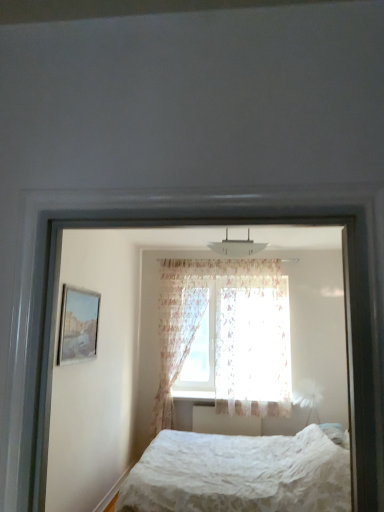
Question: Considering the relative sizes of white textured bed at center, which is the 1th bed from top to bottom, and white lace bed at lower center, the second bed from the front, in the image provided, is white textured bed at center, which is the 1th bed from top to bottom, wider than white lace bed at lower center, the second bed from the front,?

Choices:
 (A) yes
 (B) no

Answer: (B)

Question: Is white textured bed at center, marked as the 2th bed in a back-to-front arrangement, shorter than white lace bed at lower center, which is counted as the 1th bed, starting from the bottom?

Choices:
 (A) no
 (B) yes

Answer: (A)

Question: From the image's perspective, is white textured bed at center, acting as the second bed starting from the bottom, located beneath white lace bed at lower center, which is counted as the 1th bed, starting from the bottom?

Choices:
 (A) no
 (B) yes

Answer: (A)

Question: Is white lace bed at lower center, the second bed in the top-to-bottom sequence, surrounded by white textured bed at center, marked as the 2th bed in a back-to-front arrangement?

Choices:
 (A) no
 (B) yes

Answer: (A)

Question: Is white textured bed at center, marked as the 2th bed in a back-to-front arrangement, outside of white lace bed at lower center, the second bed from the front?

Choices:
 (A) no
 (B) yes

Answer: (B)

Question: Would you say white textured bed at center, acting as the second bed starting from the bottom, is inside or outside white lace bed at lower center, the second bed from the front?

Choices:
 (A) outside
 (B) inside

Answer: (A)

Question: Based on their positions, is white textured bed at center, marked as the 2th bed in a back-to-front arrangement, located to the left or right of white lace bed at lower center, which is counted as the 1th bed, starting from the bottom?

Choices:
 (A) right
 (B) left

Answer: (B)

Question: Is point (329, 500) positioned closer to the camera than point (284, 448)?

Choices:
 (A) farther
 (B) closer

Answer: (B)

Question: From a real-world perspective, is white textured bed at center, which is the 1th bed from top to bottom, above or below white lace bed at lower center, which appears as the 1th bed when viewed from the back?

Choices:
 (A) below
 (B) above

Answer: (B)

Question: Is white lace bed at lower center, which appears as the 1th bed when viewed from the back, taller or shorter than white textured bed at center, which is the 1th bed from front to back?

Choices:
 (A) short
 (B) tall

Answer: (A)

Question: Looking at the image, does white lace bed at lower center, which is counted as the 1th bed, starting from the bottom, seem bigger or smaller compared to white textured bed at center, acting as the second bed starting from the bottom?

Choices:
 (A) big
 (B) small

Answer: (A)

Question: Looking at their shapes, would you say white lace bed at lower center, which appears as the 1th bed when viewed from the back, is wider or thinner than white textured bed at center, which is the 1th bed from front to back?

Choices:
 (A) thin
 (B) wide

Answer: (B)

Question: From the image's perspective, is white lace bed at lower center, the second bed in the top-to-bottom sequence, located above or below white textured bed at center, which is the 1th bed from front to back?

Choices:
 (A) below
 (B) above

Answer: (A)

Question: Looking at their shapes, would you say matte glass picture frame at left is wider or thinner than white textured bed at center, which is the 1th bed from front to back?

Choices:
 (A) thin
 (B) wide

Answer: (A)

Question: In the image, is matte glass picture frame at left on the left side or the right side of white textured bed at center, which is the 1th bed from front to back?

Choices:
 (A) left
 (B) right

Answer: (A)